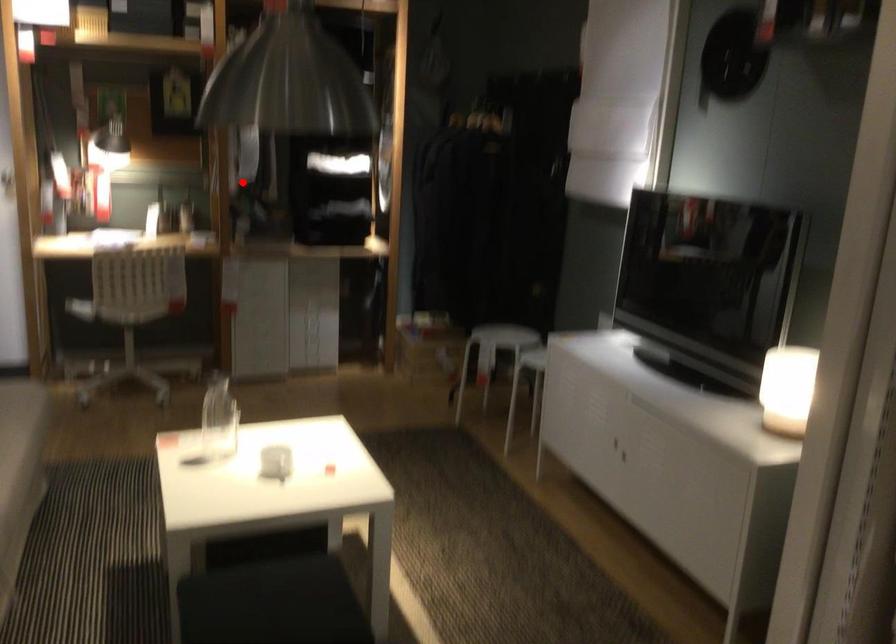
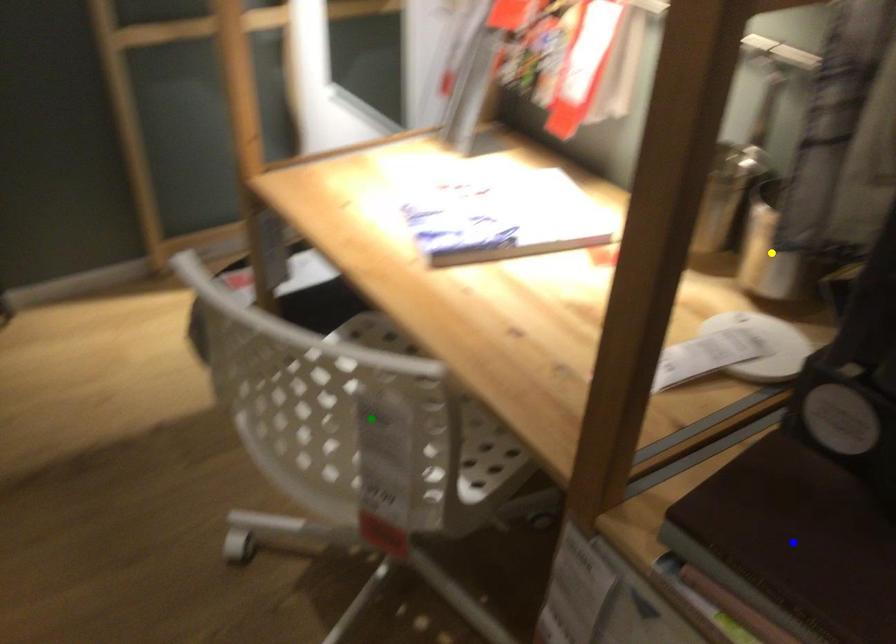
Question: I am providing you with two images of the same scene from different viewpoints. A red point is marked on the first image. You are given multiple points on the second image. Which spot in image 2 lines up with the point in image 1?

Choices:
 (A) yellow point
 (B) blue point
 (C) green point

Answer: (A)